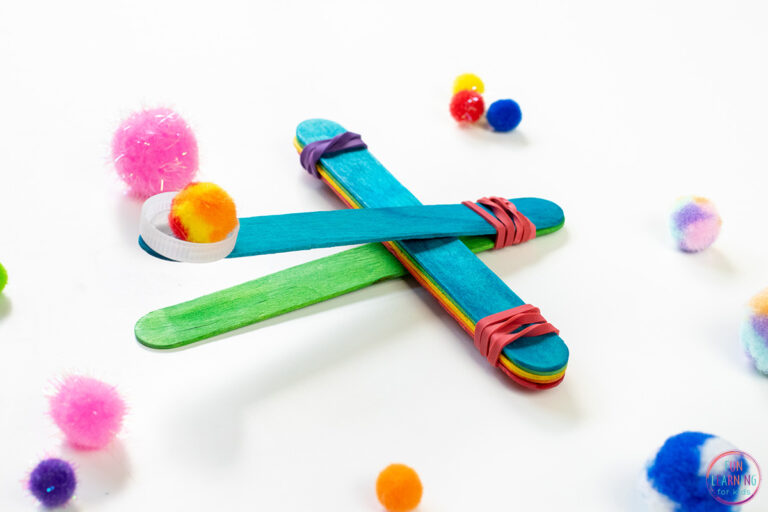
Identify the location of multicolored pom pom balls. The width and height of the screenshot is (768, 512). pos(690,215), pos(756,323), pos(689,459), pos(207,215).